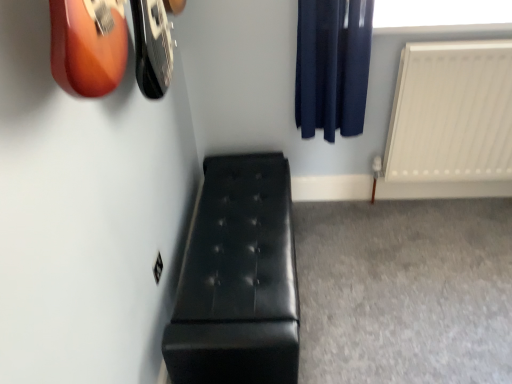
Find the location of `vacant space in front of white matte radiator at right`. vacant space in front of white matte radiator at right is located at coordinates (456, 256).